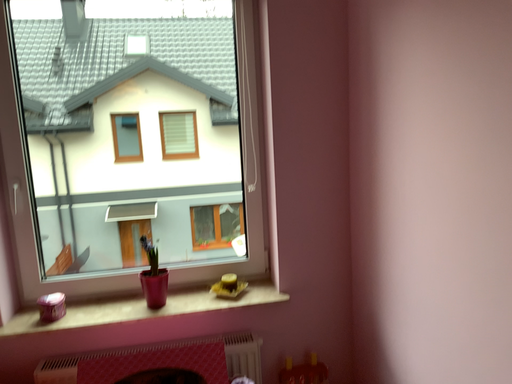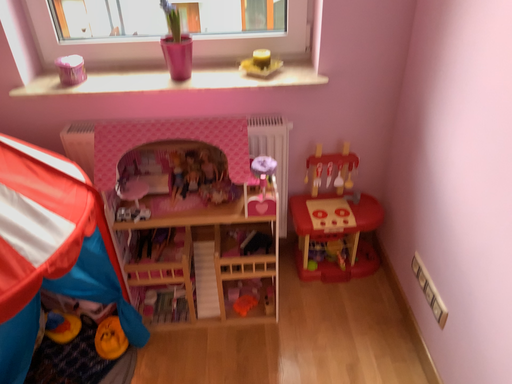
Question: How did the camera likely rotate when shooting the video?

Choices:
 (A) rotated left
 (B) rotated right

Answer: (A)